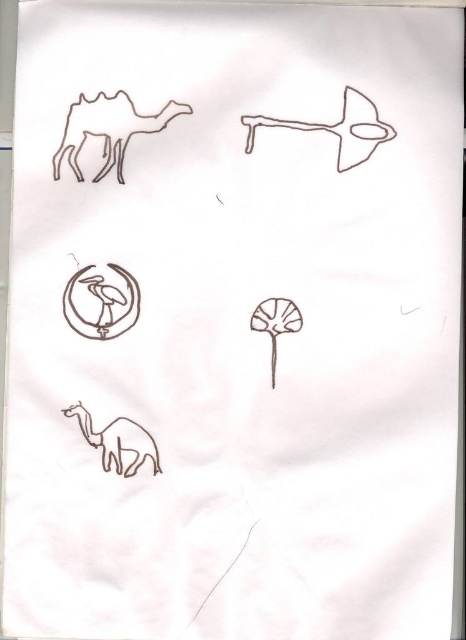
Between point (118, 182) and point (150, 460), which one is positioned behind?

The point (118, 182) is behind.

Can you confirm if brown matte camel at upper left is positioned to the right of brown line art camel at lower left?

Yes, brown matte camel at upper left is to the right of brown line art camel at lower left.

Image resolution: width=466 pixels, height=640 pixels. Describe the element at coordinates (108, 131) in the screenshot. I see `brown matte camel at upper left` at that location.

At what (x,y) coordinates should I click in order to perform the action: click on brown matte camel at upper left. Please return your answer as a coordinate pair (x, y). The image size is (466, 640). Looking at the image, I should click on (108, 131).

Between brown matte airplane at upper center and brown line art camel at lower left, which one appears on the right side from the viewer's perspective?

Positioned to the right is brown matte airplane at upper center.

Does brown matte airplane at upper center have a smaller size compared to brown line art camel at lower left?

Actually, brown matte airplane at upper center might be larger than brown line art camel at lower left.

What do you see at coordinates (336, 129) in the screenshot? I see `brown matte airplane at upper center` at bounding box center [336, 129].

Identify the location of brown matte airplane at upper center. The image size is (466, 640). (336, 129).

Who is more distant from viewer, (63, 144) or (260, 125)?

The point (260, 125) is behind.

Who is higher up, brown matte camel at upper left or brown matte airplane at upper center?

brown matte airplane at upper center is higher up.

Is point (123, 150) closer to viewer compared to point (253, 136)?

No, (123, 150) is behind (253, 136).

Locate an element on the screen. brown matte camel at upper left is located at coordinates (108, 131).